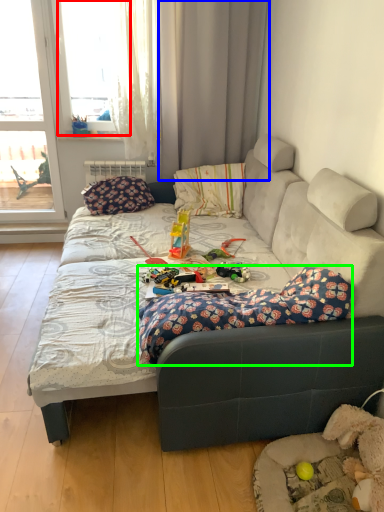
Question: Based on their relative distances, which object is nearer to window (highlighted by a red box)? Choose from curtain (highlighted by a blue box) and blanket (highlighted by a green box).

Choices:
 (A) curtain
 (B) blanket

Answer: (A)